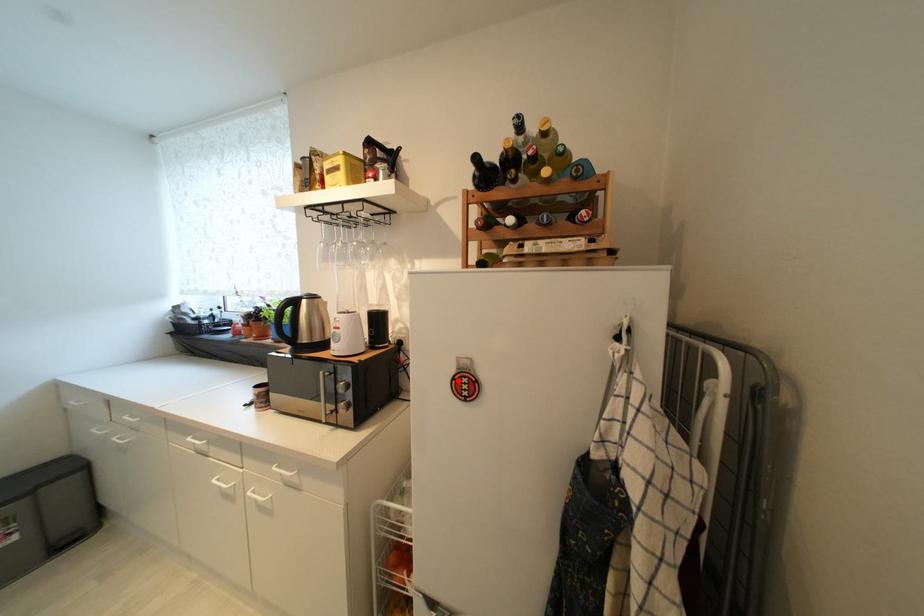
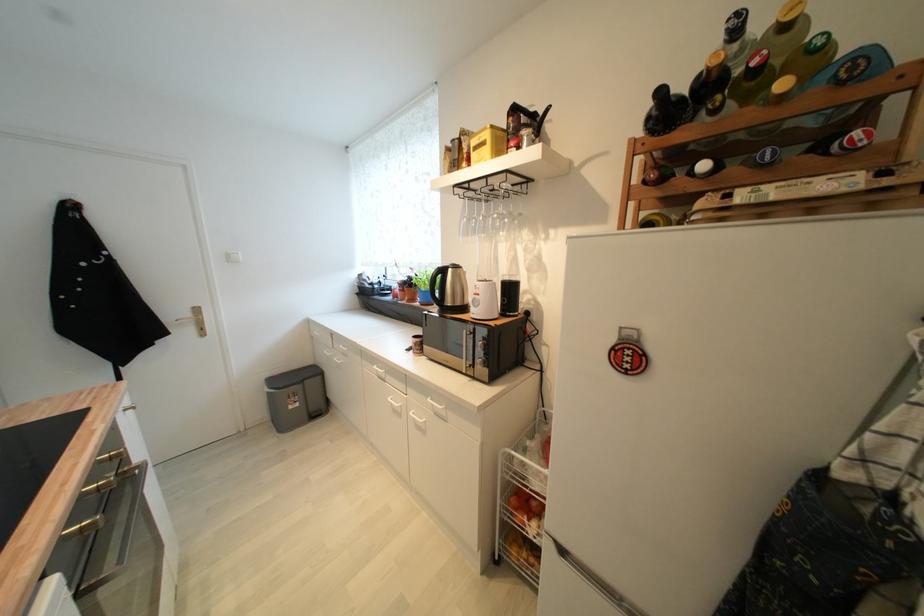
Question: I am providing you with two images of the same scene from different viewpoints. In image1, a red point is highlighted. Considering the same 3D point in image2, which of the following is correct?

Choices:
 (A) It is closer
 (B) It is farther

Answer: (A)